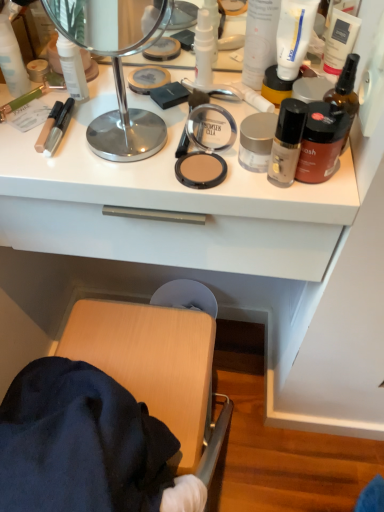
Where is `free space in front of matte black concealer at left, which is the 2th toiletry from left to right`? This screenshot has width=384, height=512. free space in front of matte black concealer at left, which is the 2th toiletry from left to right is located at coordinates (52, 164).